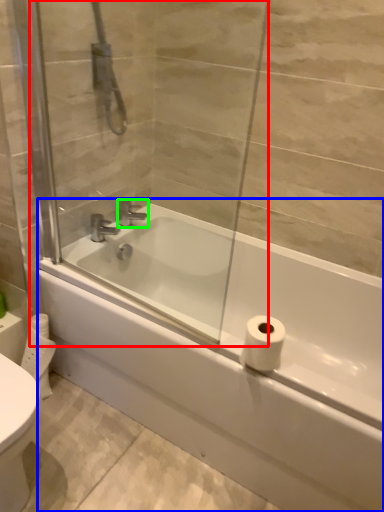
Question: Considering the real-world distances, which object is closest to screen door (highlighted by a red box)? bathtub (highlighted by a blue box) or tap (highlighted by a green box).

Choices:
 (A) bathtub
 (B) tap

Answer: (A)